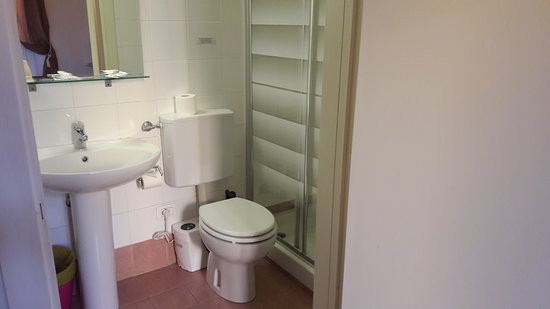
The width and height of the screenshot is (550, 309). Find the location of `toilet paper`. toilet paper is located at coordinates (185, 100).